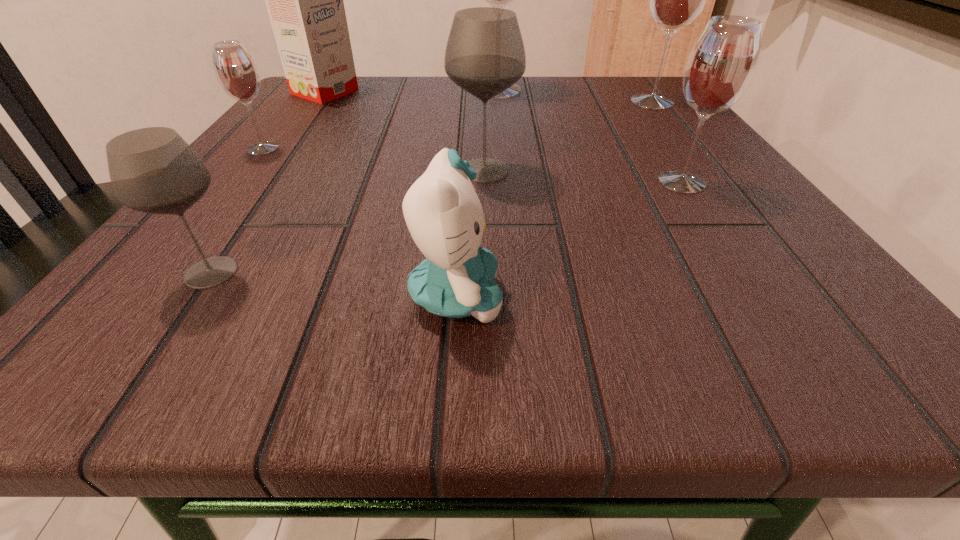
Where is `the nearer gray wineglass`? the nearer gray wineglass is located at coordinates (153, 170).

I want to click on kitten, so click(445, 218).

Identify the location of blank area located 0.260m on the front of the third red wineglass from right to left. The width and height of the screenshot is (960, 540). (503, 167).

At what (x,y) coordinates should I click in order to perform the action: click on vacant space located on the front of the carton. Please return your answer as a coordinate pair (x, y). The width and height of the screenshot is (960, 540). Looking at the image, I should click on (280, 153).

Find the location of a particular element. free space located on the left of the second tallest wineglass is located at coordinates (548, 102).

I want to click on vacant space situated on the back of the bigger gray wineglass, so click(484, 107).

Locate an element on the screen. This screenshot has width=960, height=540. vacant area situated on the left of the third biggest red wineglass is located at coordinates point(619,183).

Where is `free location located 0.080m on the front of the smallest red wineglass`? The width and height of the screenshot is (960, 540). free location located 0.080m on the front of the smallest red wineglass is located at coordinates (234, 184).

This screenshot has height=540, width=960. In order to click on vacant area situated 0.380m on the right of the nearest wineglass in this screenshot , I will do `click(596, 273)`.

Identify the location of free space located on the face of the kitten. (756, 297).